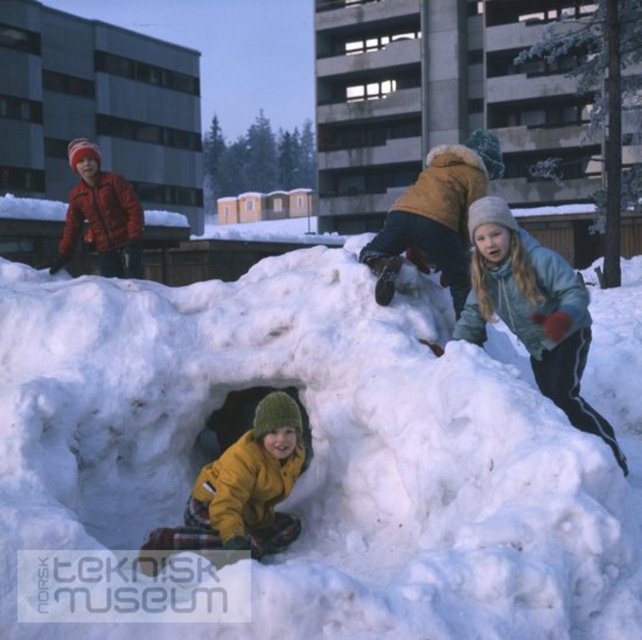
You are a parent trying to ensure the children are safe while playing in the snow fort. The white fluffy snow at center and the blue fleece jacket at upper right are visible. Which object is larger?

The blue fleece jacket at upper right is larger than the white fluffy snow at center.